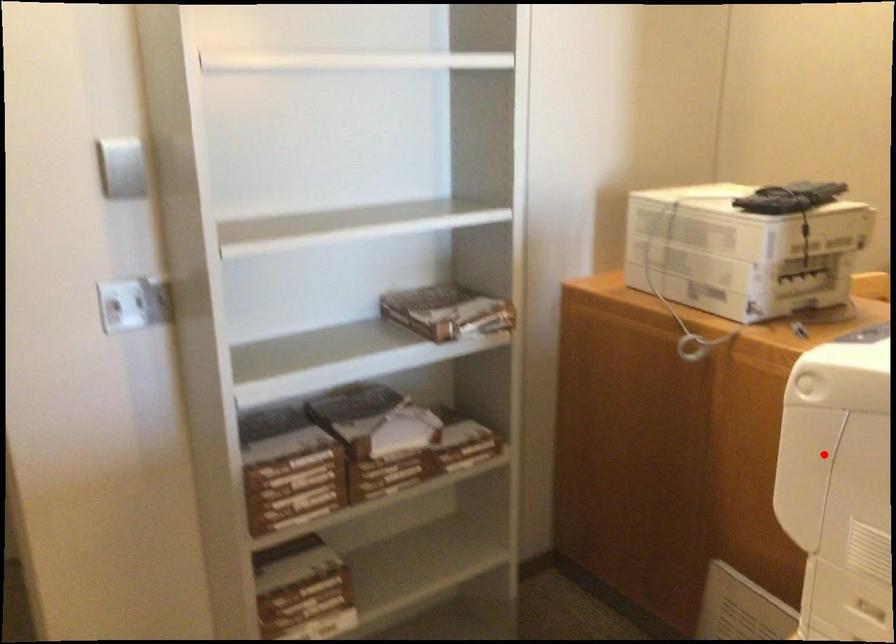
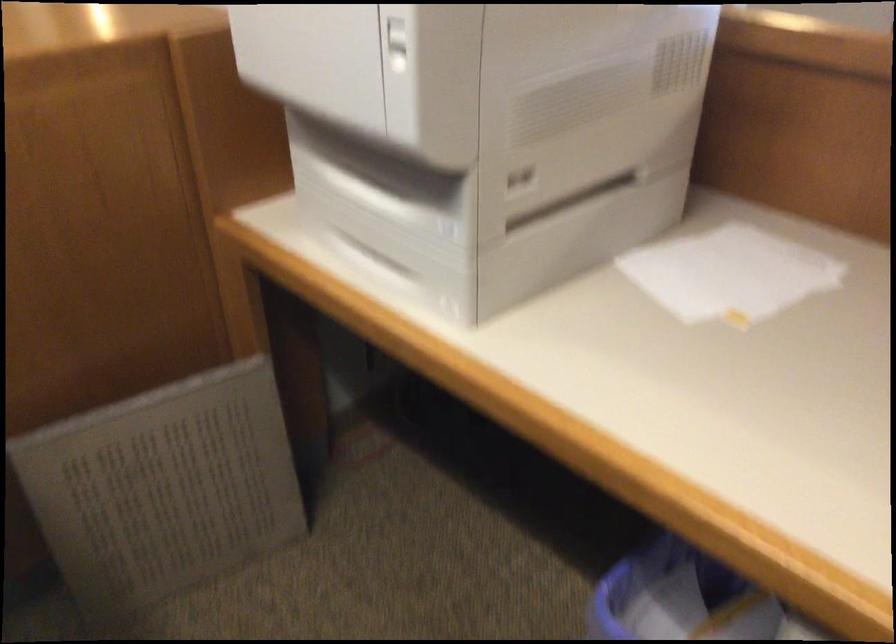
In the second image, find the point that corresponds to the highlighted location in the first image.

(397, 44)